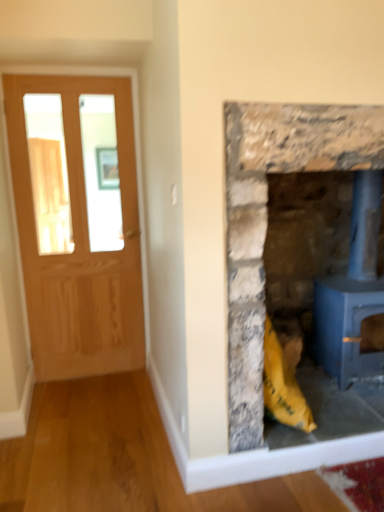
Question: Considering the positions of blue painted metal wood burning stove at right and rustic stone fireplace at right in the image, is blue painted metal wood burning stove at right wider or thinner than rustic stone fireplace at right?

Choices:
 (A) thin
 (B) wide

Answer: (A)

Question: From the image's perspective, is blue painted metal wood burning stove at right positioned above or below rustic stone fireplace at right?

Choices:
 (A) above
 (B) below

Answer: (B)

Question: Based on their relative distances, which object is farther from the rustic stone fireplace at right?

Choices:
 (A) blue painted metal wood burning stove at right
 (B) matte wooden door at left

Answer: (B)

Question: Based on their relative distances, which object is farther from the blue painted metal wood burning stove at right?

Choices:
 (A) matte wooden door at left
 (B) rustic stone fireplace at right

Answer: (A)